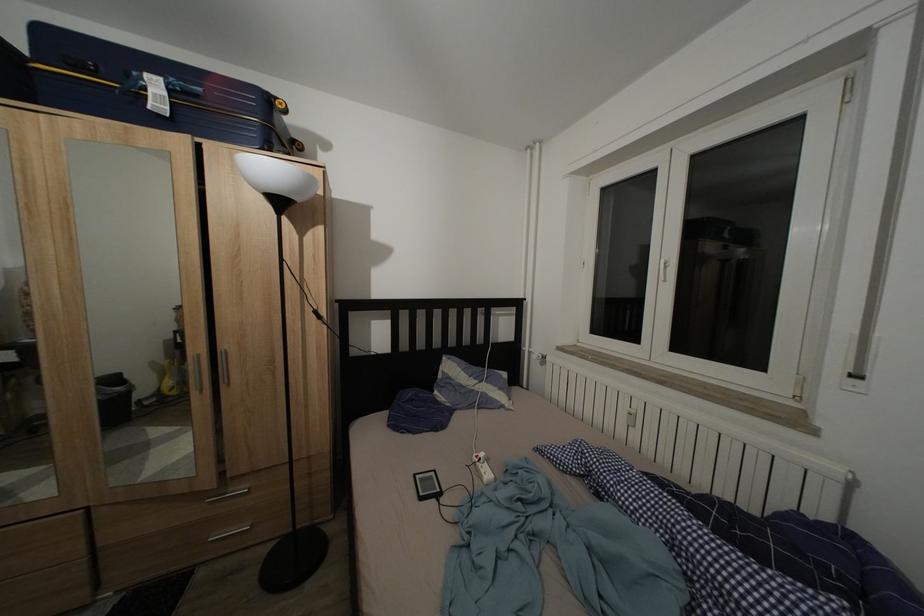
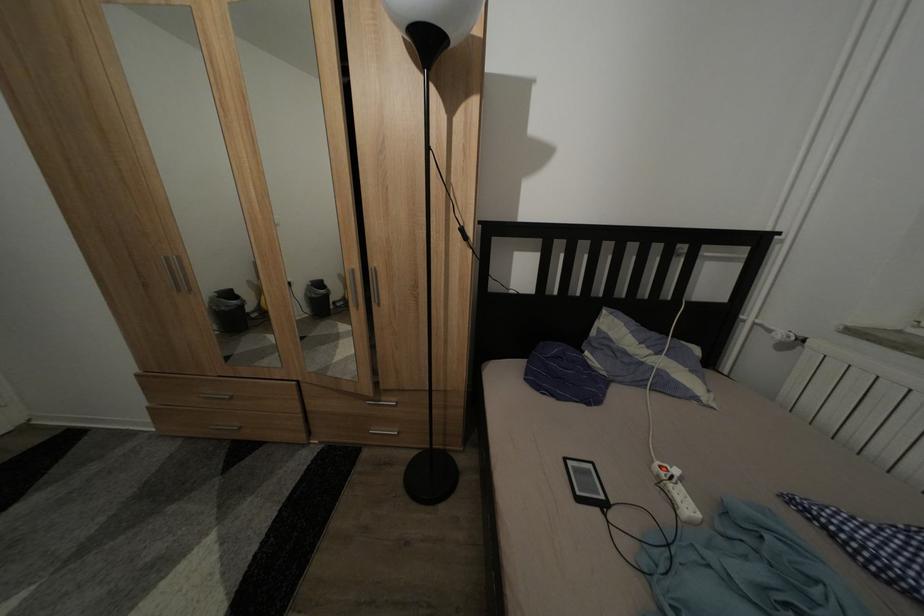
Find the pixel in the second image that matches (x=422, y=482) in the first image.

(573, 466)